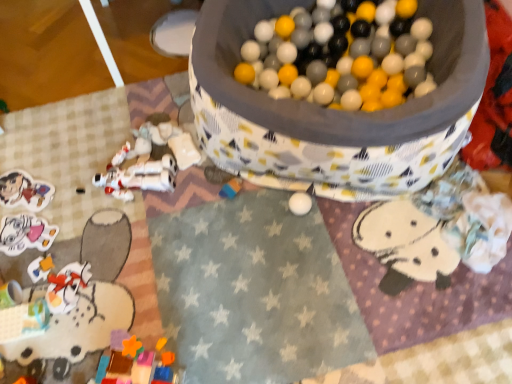
What are the coordinates of `free point to the right of white plastic astronaut at lower left, placed as the 4th toy when sorted from left to right` in the screenshot? It's located at (200, 190).